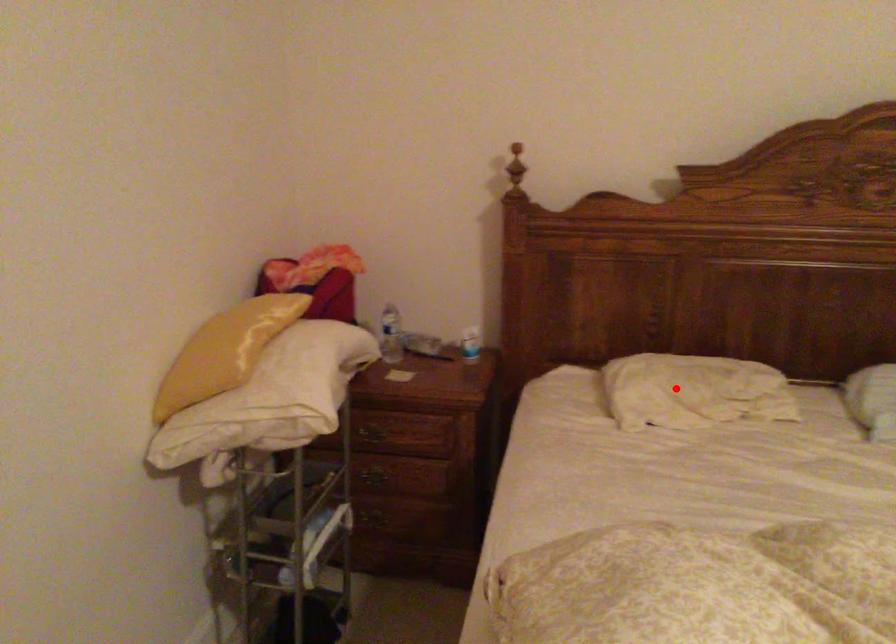
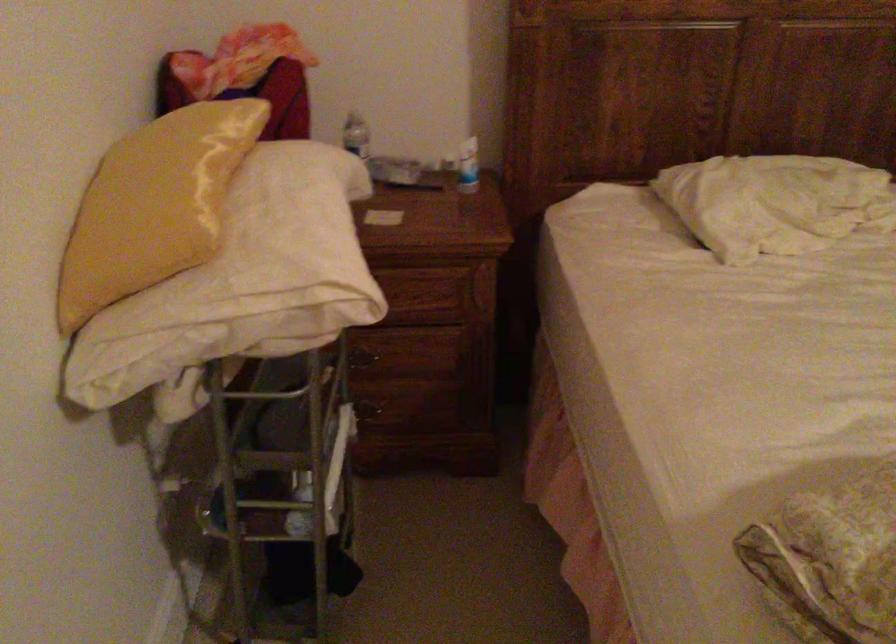
Find the pixel in the second image that matches the highlighted location in the first image.

(774, 202)